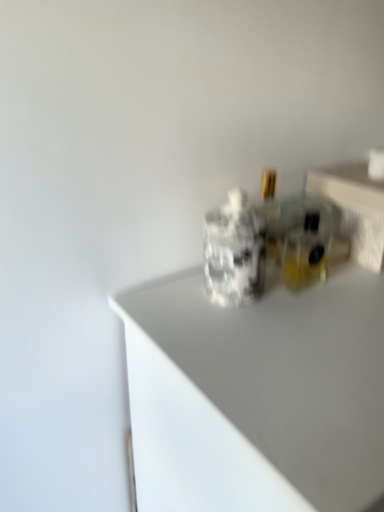
Question: Is white glossy countertop at center in front of or behind transparent glass perfume bottles at upper right in the image?

Choices:
 (A) behind
 (B) front

Answer: (B)

Question: Is point (162, 483) closer or farther from the camera than point (319, 173)?

Choices:
 (A) closer
 (B) farther

Answer: (A)

Question: In terms of width, does white glossy countertop at center look wider or thinner when compared to transparent glass perfume bottles at upper right?

Choices:
 (A) thin
 (B) wide

Answer: (B)

Question: Is transparent glass perfume bottles at upper right taller or shorter than white glossy countertop at center?

Choices:
 (A) tall
 (B) short

Answer: (B)

Question: From the image's perspective, relative to white glossy countertop at center, is transparent glass perfume bottles at upper right above or below?

Choices:
 (A) below
 (B) above

Answer: (B)

Question: Is transparent glass perfume bottles at upper right in front of or behind white glossy countertop at center in the image?

Choices:
 (A) front
 (B) behind

Answer: (B)

Question: Considering the positions of point (372, 180) and point (170, 430), is point (372, 180) closer or farther from the camera than point (170, 430)?

Choices:
 (A) farther
 (B) closer

Answer: (A)